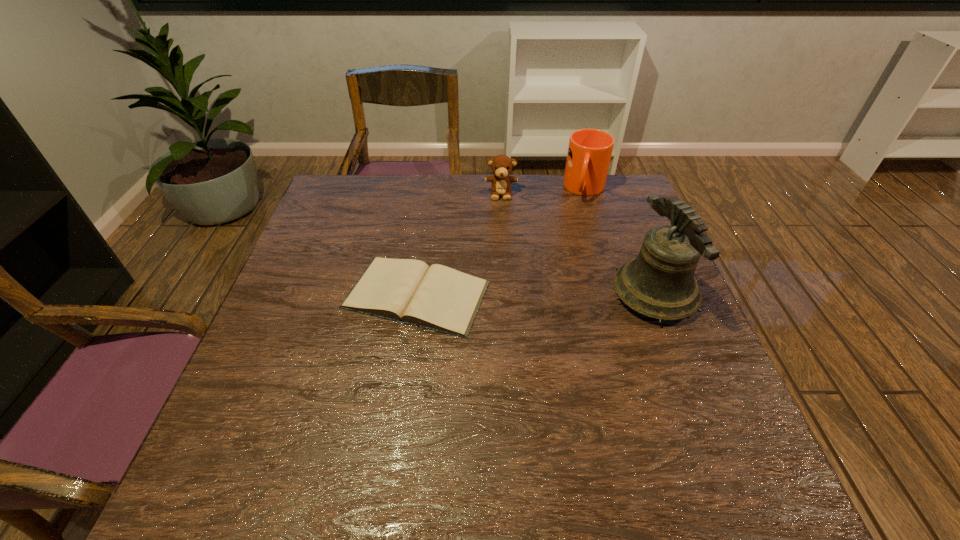
Find the location of a particular element. This screenshot has width=960, height=540. the shortest object is located at coordinates 440,298.

The height and width of the screenshot is (540, 960). In order to click on the tallest object in this screenshot , I will do `click(659, 283)`.

At what (x,y) coordinates should I click in order to perform the action: click on the second shortest object. Please return your answer as a coordinate pair (x, y). This screenshot has width=960, height=540. Looking at the image, I should click on (501, 166).

Find the location of a particular element. This screenshot has height=540, width=960. the third shortest object is located at coordinates (589, 153).

Locate an element on the screen. This screenshot has height=540, width=960. vacant space located 0.050m on the right of the shortest object is located at coordinates (511, 295).

Where is `free space located 0.320m on the back of the bell`? This screenshot has height=540, width=960. free space located 0.320m on the back of the bell is located at coordinates (615, 196).

Image resolution: width=960 pixels, height=540 pixels. In order to click on free spot located 0.170m on the face of the third tallest object in this screenshot , I will do `click(500, 236)`.

You are a GUI agent. You are given a task and a screenshot of the screen. Output one action in this format:
    pyautogui.click(x=<x>, y=<y>)
    Task: Click on the free space located on the face of the third tallest object
    The image size is (960, 540).
    Given the screenshot: What is the action you would take?
    pyautogui.click(x=500, y=221)

Find the location of a particular element. Image resolution: width=960 pixels, height=540 pixels. vacant space located 0.310m on the face of the third tallest object is located at coordinates (500, 270).

The image size is (960, 540). What are the coordinates of `free space located 0.120m on the handle side of the mug` in the screenshot? It's located at (581, 230).